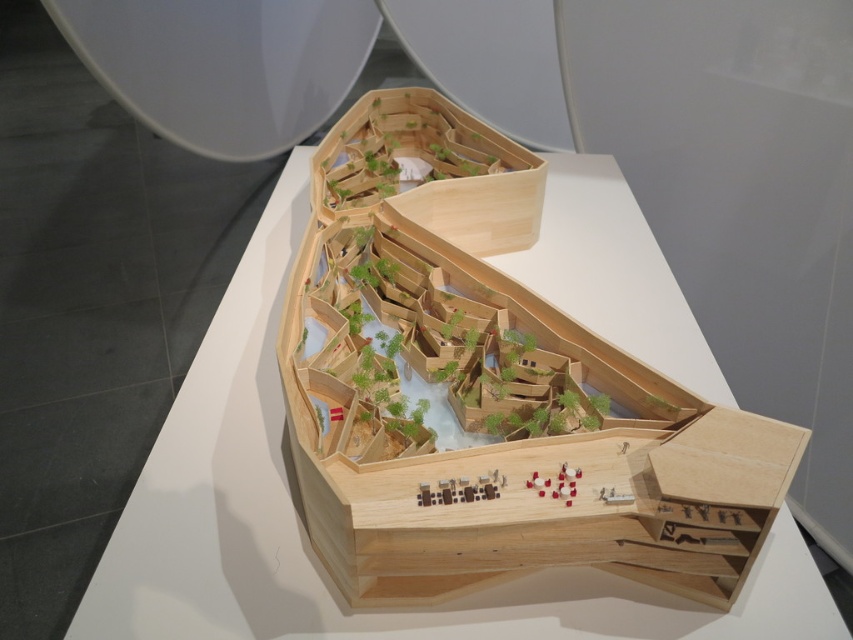
Question: Which object is closer to the camera taking this photo?

Choices:
 (A) natural wood boat at center
 (B) natural wood model at center

Answer: (A)

Question: Can you confirm if natural wood boat at center is smaller than natural wood model at center?

Choices:
 (A) yes
 (B) no

Answer: (A)

Question: Observing the image, what is the correct spatial positioning of natural wood boat at center in reference to natural wood model at center?

Choices:
 (A) below
 (B) above

Answer: (A)

Question: Can you confirm if natural wood boat at center is bigger than natural wood model at center?

Choices:
 (A) no
 (B) yes

Answer: (A)

Question: Which object appears farthest from the camera in this image?

Choices:
 (A) natural wood model at center
 (B) natural wood boat at center

Answer: (A)